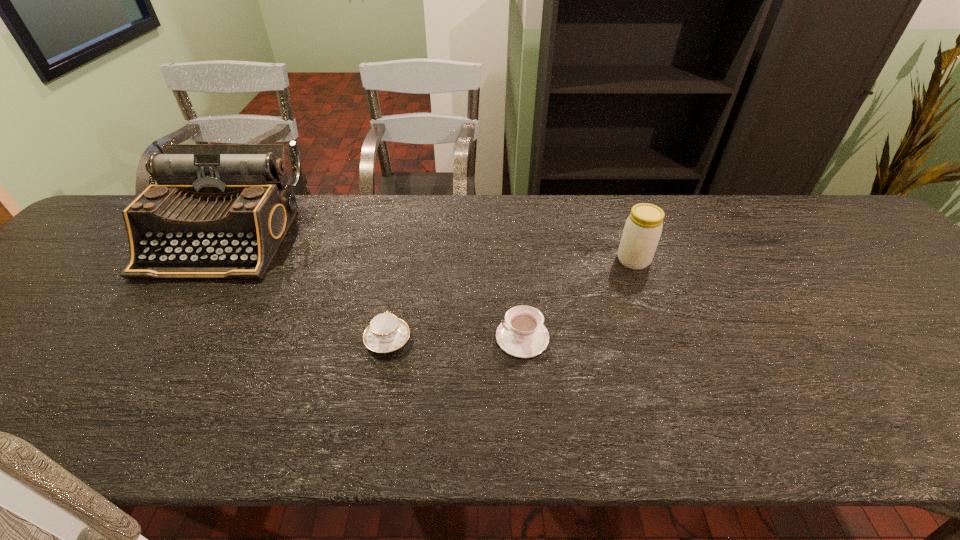
This screenshot has height=540, width=960. Identify the location of free spot between the right teacup and the jar. (578, 299).

The image size is (960, 540). Find the location of `vacant area that lies between the second object from right to left and the leftmost object`. vacant area that lies between the second object from right to left and the leftmost object is located at coordinates click(373, 287).

Locate an element on the screen. This screenshot has height=540, width=960. free space between the left teacup and the second object from right to left is located at coordinates (455, 339).

Where is `unoccupied position between the second tallest object and the second object from left to right`? unoccupied position between the second tallest object and the second object from left to right is located at coordinates (511, 300).

Identify the location of free spot between the right teacup and the leftmost object. (373, 287).

At what (x,y) coordinates should I click in order to perform the action: click on vacant space that is in between the jar and the left teacup. Please return your answer as a coordinate pair (x, y). This screenshot has width=960, height=540. Looking at the image, I should click on (511, 300).

This screenshot has height=540, width=960. Find the location of `free space between the rightmost object and the second object from right to left`. free space between the rightmost object and the second object from right to left is located at coordinates (578, 299).

This screenshot has width=960, height=540. I want to click on free point between the second tallest object and the third object from left to right, so click(578, 299).

Find the location of `object that ranks as the closest to the typewriter`. object that ranks as the closest to the typewriter is located at coordinates (386, 333).

Where is `object that is the second nearest to the tallest object`? object that is the second nearest to the tallest object is located at coordinates (522, 334).